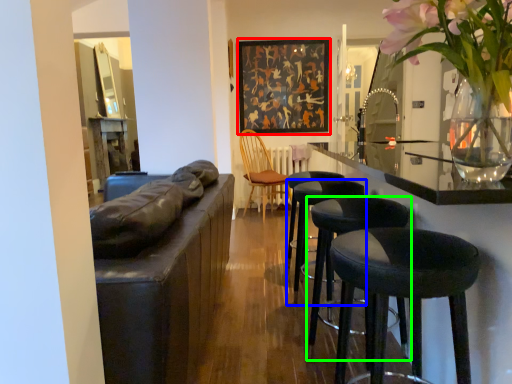
Question: Which object is positioned closest to picture frame (highlighted by a red box)? Select from stool (highlighted by a blue box) and stool (highlighted by a green box).

Choices:
 (A) stool
 (B) stool

Answer: (A)